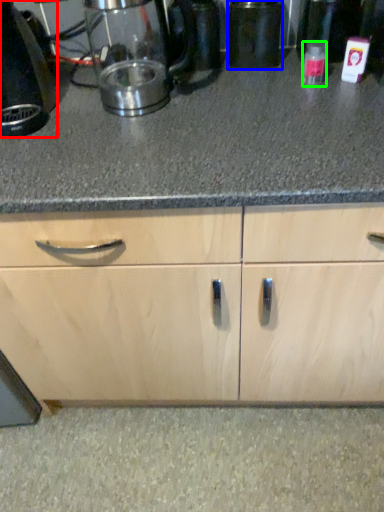
Question: Which object is positioned farthest from home appliance (highlighted by a red box)? Select from appliance (highlighted by a blue box) and bottle (highlighted by a green box).

Choices:
 (A) appliance
 (B) bottle

Answer: (B)